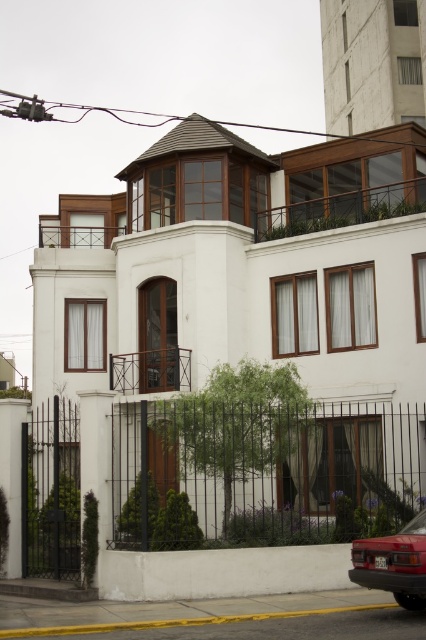
Can you confirm if black wrought iron fence at lower left is smaller than matte red car at lower right?

Actually, black wrought iron fence at lower left might be larger than matte red car at lower right.

Which is above, black wrought iron fence at lower left or matte red car at lower right?

matte red car at lower right

Between point (391, 490) and point (388, 573), which one is positioned behind?

The point (391, 490) is behind.

I want to click on black wrought iron fence at lower left, so click(x=261, y=474).